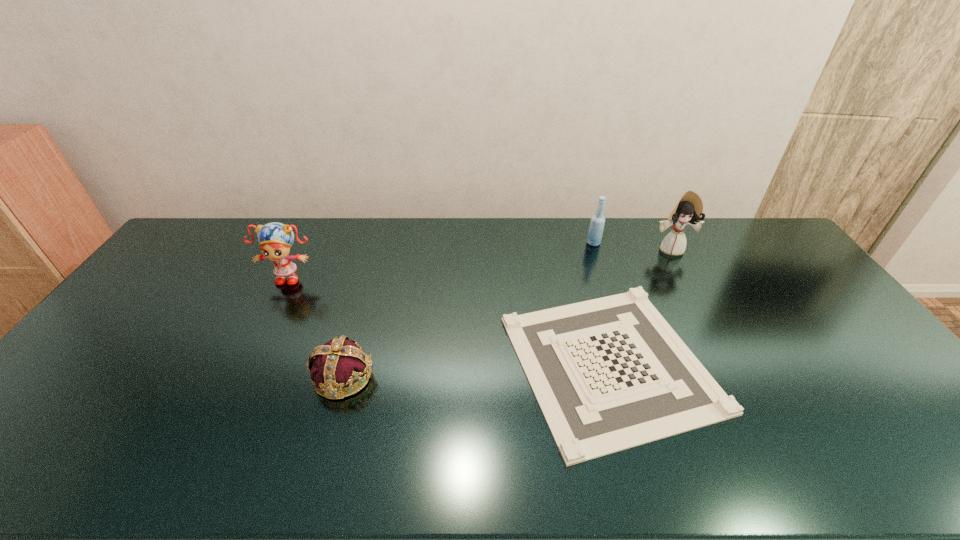
The height and width of the screenshot is (540, 960). I want to click on the farther doll, so click(x=688, y=210).

Where is `the leftmost object`? Image resolution: width=960 pixels, height=540 pixels. the leftmost object is located at coordinates (275, 239).

At what (x,y) coordinates should I click in order to perform the action: click on the third nearest object. Please return your answer as a coordinate pair (x, y). The height and width of the screenshot is (540, 960). Looking at the image, I should click on (275, 239).

I want to click on bottle, so (595, 232).

Identify the location of crown. The image size is (960, 540). (340, 362).

Where is `the fourth tallest object`? The image size is (960, 540). the fourth tallest object is located at coordinates (340, 362).

Find the location of a particular element. The height and width of the screenshot is (540, 960). checkerboard is located at coordinates (609, 374).

At what (x,y) coordinates should I click in order to perform the action: click on vacant region located at the front face of the farther doll. Please return your answer as a coordinate pair (x, y). Looking at the image, I should click on (694, 293).

The image size is (960, 540). Find the location of `vacant space located 0.060m on the face of the left doll`. vacant space located 0.060m on the face of the left doll is located at coordinates (276, 301).

Identify the location of vacant space located on the left of the bottle. (493, 243).